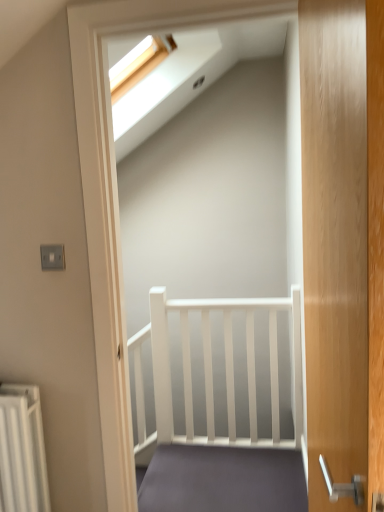
Question: From the image's perspective, is wooden door at right on matte gray carpet at center?

Choices:
 (A) no
 (B) yes

Answer: (B)

Question: Is wooden door at right taller than matte gray carpet at center?

Choices:
 (A) no
 (B) yes

Answer: (B)

Question: Considering the relative sizes of wooden door at right and matte gray carpet at center in the image provided, is wooden door at right wider than matte gray carpet at center?

Choices:
 (A) yes
 (B) no

Answer: (B)

Question: From a real-world perspective, is wooden door at right located beneath matte gray carpet at center?

Choices:
 (A) no
 (B) yes

Answer: (A)

Question: From the image's perspective, does wooden door at right appear lower than matte gray carpet at center?

Choices:
 (A) no
 (B) yes

Answer: (A)

Question: Is wooden door at right positioned beyond the bounds of matte gray carpet at center?

Choices:
 (A) no
 (B) yes

Answer: (B)

Question: Is matte gray carpet at center not near wooden door at right?

Choices:
 (A) yes
 (B) no

Answer: (A)

Question: Can you confirm if matte gray carpet at center is wider than wooden door at right?

Choices:
 (A) yes
 (B) no

Answer: (A)

Question: From a real-world perspective, is matte gray carpet at center on top of wooden door at right?

Choices:
 (A) yes
 (B) no

Answer: (B)

Question: Does matte gray carpet at center have a smaller size compared to wooden door at right?

Choices:
 (A) yes
 (B) no

Answer: (A)

Question: Considering the relative sizes of matte gray carpet at center and wooden door at right in the image provided, is matte gray carpet at center thinner than wooden door at right?

Choices:
 (A) yes
 (B) no

Answer: (B)

Question: From a real-world perspective, is matte gray carpet at center below wooden door at right?

Choices:
 (A) no
 (B) yes

Answer: (B)

Question: From the image's perspective, is wooden door at right positioned above or below matte gray carpet at center?

Choices:
 (A) above
 (B) below

Answer: (A)